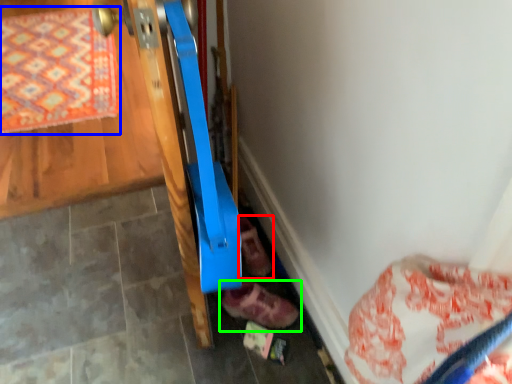
Question: Considering the real-world distances, which object is farthest from footwear (highlighted by a red box)? mat (highlighted by a blue box) or footwear (highlighted by a green box)?

Choices:
 (A) mat
 (B) footwear

Answer: (A)